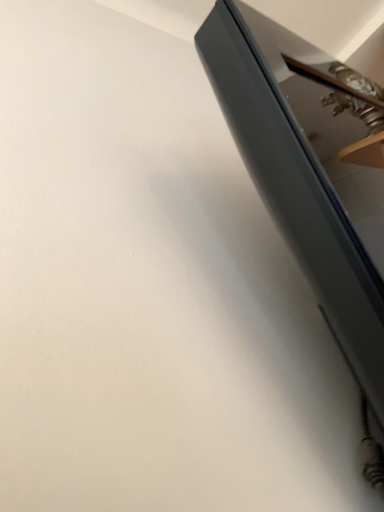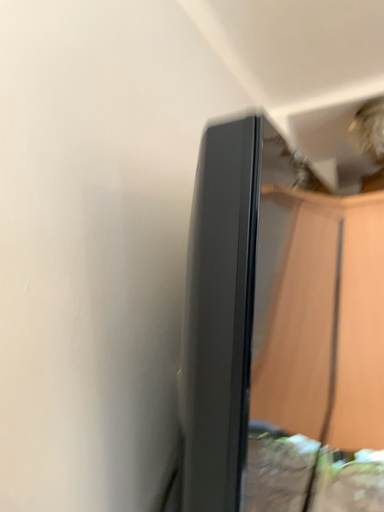
Question: Which way did the camera rotate in the video?

Choices:
 (A) rotated right
 (B) rotated left

Answer: (A)